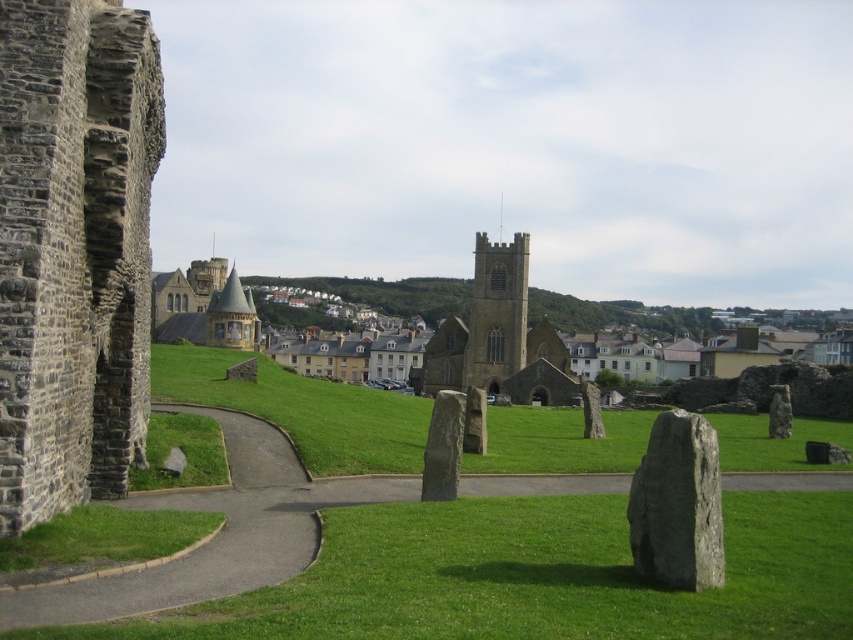
Who is more distant from viewer, (158, 346) or (450, 433)?

The point (158, 346) is more distant.

Which is behind, point (407, 406) or point (434, 476)?

The point (407, 406) is more distant.

Where is `green grassy field at center`? green grassy field at center is located at coordinates (302, 410).

Can you confirm if gray rough stone at center is shorter than smooth gray stone at center?

In fact, gray rough stone at center may be taller than smooth gray stone at center.

Which is behind, point (659, 504) or point (772, 404)?

The point (772, 404) is more distant.

You are a GUI agent. You are given a task and a screenshot of the screen. Output one action in this format:
    pyautogui.click(x=<x>, y=<y>)
    Task: Click on the gray rough stone at center
    
    Given the screenshot: What is the action you would take?
    pyautogui.click(x=677, y=504)

Can you confirm if dark brown stone tower at center is smaller than gray polished stone at center?

No, dark brown stone tower at center is not smaller than gray polished stone at center.

From the picture: Does dark brown stone tower at center appear under gray polished stone at center?

No, dark brown stone tower at center is not below gray polished stone at center.

Between point (486, 275) and point (440, 484), which one is positioned in front?

Positioned in front is point (440, 484).

Find the location of a particular element. This screenshot has height=640, width=853. dark brown stone tower at center is located at coordinates (497, 312).